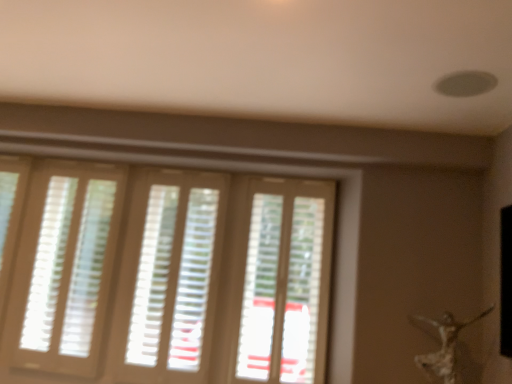
Question: From a real-world perspective, does silver metallic statue at lower right stand above translucent plastic screen door at center?

Choices:
 (A) no
 (B) yes

Answer: (A)

Question: Are silver metallic statue at lower right and translucent plastic screen door at center beside each other?

Choices:
 (A) no
 (B) yes

Answer: (A)

Question: Is silver metallic statue at lower right taller than translucent plastic screen door at center?

Choices:
 (A) no
 (B) yes

Answer: (A)

Question: From the image's perspective, is silver metallic statue at lower right on translucent plastic screen door at center?

Choices:
 (A) yes
 (B) no

Answer: (B)

Question: Considering the relative sizes of silver metallic statue at lower right and translucent plastic screen door at center in the image provided, is silver metallic statue at lower right wider than translucent plastic screen door at center?

Choices:
 (A) no
 (B) yes

Answer: (B)

Question: Based on their sizes in the image, would you say light beige wooden blinds at left, the second blind from the right, is bigger or smaller than white matte blinds at center, which is counted as the second blind, starting from the left?

Choices:
 (A) big
 (B) small

Answer: (B)

Question: Is light beige wooden blinds at left, marked as the first blind in a left-to-right arrangement, spatially inside white matte blinds at center, which is counted as the second blind, starting from the left, or outside of it?

Choices:
 (A) outside
 (B) inside

Answer: (A)

Question: In the image, is light beige wooden blinds at left, marked as the first blind in a left-to-right arrangement, positioned in front of or behind white matte blinds at center, which ranks as the 1th blind in right-to-left order?

Choices:
 (A) front
 (B) behind

Answer: (B)

Question: From their relative heights in the image, would you say light beige wooden blinds at left, marked as the first blind in a left-to-right arrangement, is taller or shorter than white matte blinds at center, which is counted as the second blind, starting from the left?

Choices:
 (A) short
 (B) tall

Answer: (B)

Question: Is point (69, 241) closer or farther from the camera than point (454, 352)?

Choices:
 (A) farther
 (B) closer

Answer: (A)

Question: From the image's perspective, is light beige wooden blinds at left, marked as the first blind in a left-to-right arrangement, located above or below silver metallic statue at lower right?

Choices:
 (A) above
 (B) below

Answer: (A)

Question: In terms of width, does light beige wooden blinds at left, marked as the first blind in a left-to-right arrangement, look wider or thinner when compared to silver metallic statue at lower right?

Choices:
 (A) thin
 (B) wide

Answer: (A)

Question: From a real-world perspective, is light beige wooden blinds at left, the second blind from the right, above or below silver metallic statue at lower right?

Choices:
 (A) above
 (B) below

Answer: (A)

Question: Based on their sizes in the image, would you say silver metallic statue at lower right is bigger or smaller than white matte blinds at center, which is counted as the second blind, starting from the left?

Choices:
 (A) big
 (B) small

Answer: (B)

Question: Is silver metallic statue at lower right taller or shorter than white matte blinds at center, which ranks as the 1th blind in right-to-left order?

Choices:
 (A) short
 (B) tall

Answer: (A)